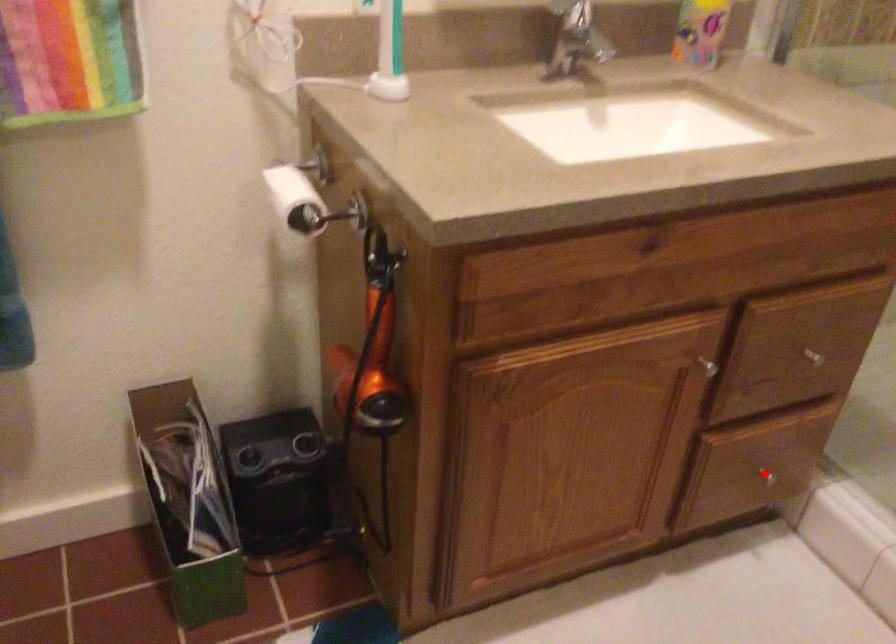
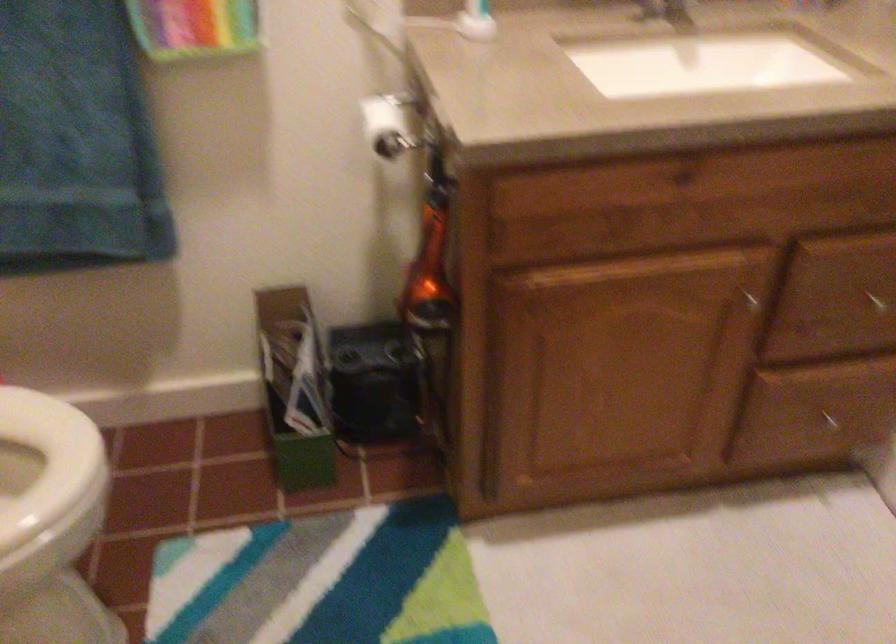
Locate, in the second image, the point that corresponds to the highlighted location in the first image.

(831, 422)